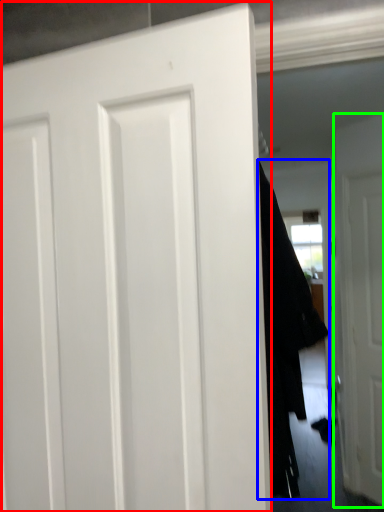
Question: Which is farther away from door (highlighted by a red box)? garment (highlighted by a blue box) or door (highlighted by a green box)?

Choices:
 (A) garment
 (B) door

Answer: (B)